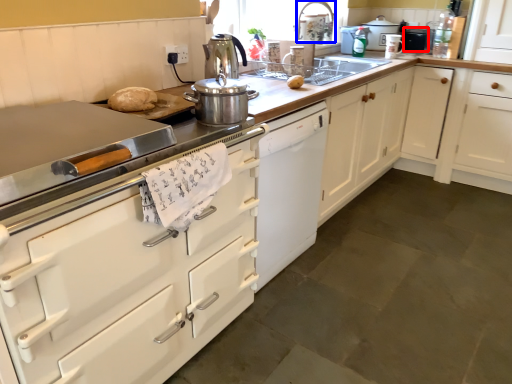
Question: Which of the following is the farthest to the observer, appliance (highlighted by a red box) or faucet (highlighted by a blue box)?

Choices:
 (A) appliance
 (B) faucet

Answer: (A)